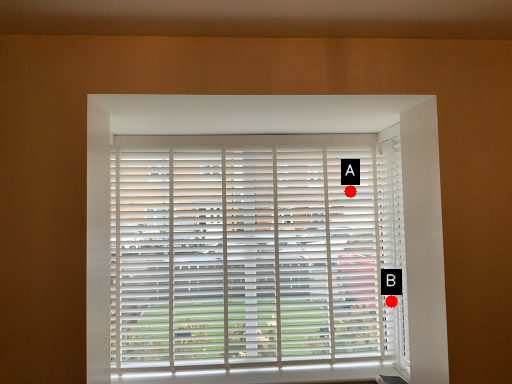
Question: Two points are circled on the image, labeled by A and B beside each circle. Which point is closer to the camera?

Choices:
 (A) A is closer
 (B) B is closer

Answer: (B)